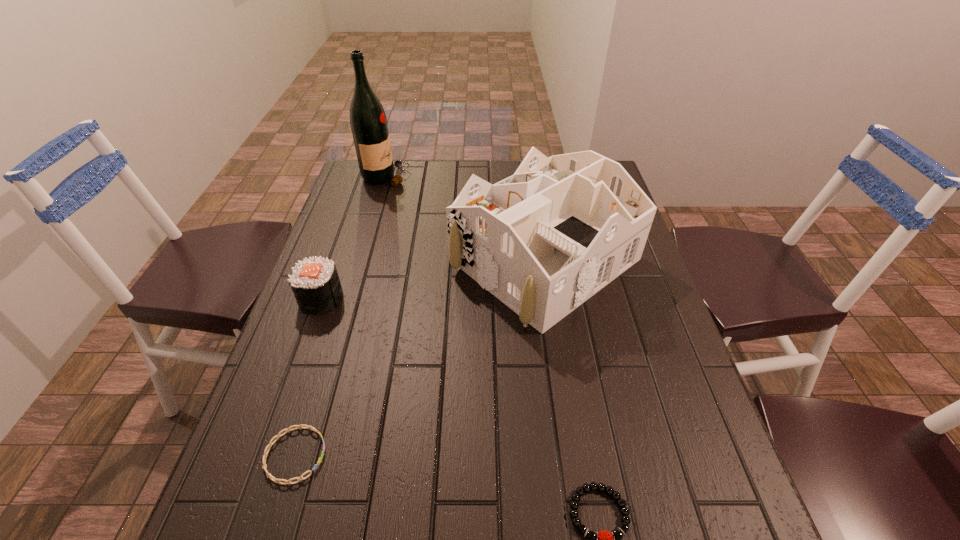
Find the location of a particular element. wine bottle located in the left edge section of the desktop is located at coordinates (368, 121).

The width and height of the screenshot is (960, 540). In order to click on sushi that is positioned at the left edge in this screenshot , I will do `click(315, 283)`.

Where is `bracelet that is at the left edge`? The image size is (960, 540). bracelet that is at the left edge is located at coordinates (278, 435).

Locate an element on the screen. This screenshot has width=960, height=540. object that is at the right edge is located at coordinates (543, 241).

Locate an element on the screen. The height and width of the screenshot is (540, 960). object that is at the far left corner is located at coordinates pyautogui.click(x=368, y=121).

In the image, there is a desktop. Where is `vacant space at the far edge`? vacant space at the far edge is located at coordinates (456, 166).

The width and height of the screenshot is (960, 540). Find the location of `free space at the left edge of the desktop`. free space at the left edge of the desktop is located at coordinates (352, 320).

The height and width of the screenshot is (540, 960). Identify the location of vacant point at the right edge. (650, 353).

Where is `vacant area that lies between the left bracelet and the dollhouse`? vacant area that lies between the left bracelet and the dollhouse is located at coordinates (420, 357).

Find the location of a particular element. free space between the sushi and the left bracelet is located at coordinates (308, 377).